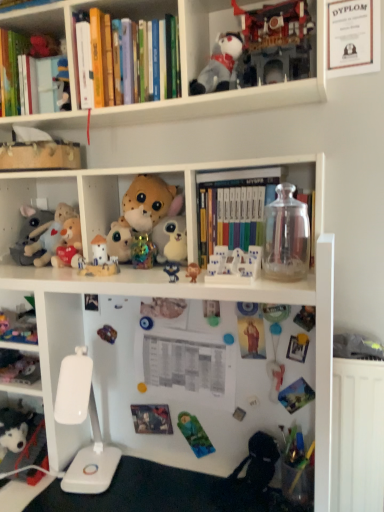
In order to face matte pink plush at lower left, acting as the 13th toy starting from the top, should I rotate leftwards or rightwards?

You should rotate left by 22.633 degrees.

How much space does transparent glass jar at center, which appears as the first book when ordered from the bottom, occupy horizontally?

The width of transparent glass jar at center, which appears as the first book when ordered from the bottom, is 6.30 inches.

The width and height of the screenshot is (384, 512). Describe the element at coordinates (29, 233) in the screenshot. I see `fluffy plush toy at left, marked as the 4th toy in a top-to-bottom arrangement` at that location.

In order to face matte green book at upper left, the third book in the right-to-left sequence, should I rotate leftwards or rightwards?

Turn left approximately 22.363 degrees to face it.

Based on the photo, what is the approximate height of matte green book at upper left, the 3th book positioned from the bottom?

10.53 inches.

Find the location of `porcelain figurines at center, which is the eighth toy in top-to-bottom order`. porcelain figurines at center, which is the eighth toy in top-to-bottom order is located at coordinates (234, 266).

From the image's perspective, which one is positioned higher, porcelain figurines at center, the eighth toy when ordered from bottom to top, or matte plastic toy at upper center, positioned as the 1th toy in top-to-bottom order?

matte plastic toy at upper center, positioned as the 1th toy in top-to-bottom order, appears higher in the image.

What's the angular difference between porcelain figurines at center, the eighth toy when ordered from bottom to top, and matte plastic toy at upper center, positioned as the 1th toy in top-to-bottom order,'s facing directions?

There is a 0.000463-degree angle between the facing directions of porcelain figurines at center, the eighth toy when ordered from bottom to top, and matte plastic toy at upper center, positioned as the 1th toy in top-to-bottom order.

Based on the photo, is porcelain figurines at center, which is the eighth toy in top-to-bottom order, beside matte plastic toy at upper center, positioned as the 1th toy in top-to-bottom order?

There is a gap between porcelain figurines at center, which is the eighth toy in top-to-bottom order, and matte plastic toy at upper center, positioned as the 1th toy in top-to-bottom order.

Considering the sizes of porcelain figurines at center, the eighth toy when ordered from bottom to top, and matte plastic toy at upper center, acting as the 15th toy starting from the bottom, in the image, is porcelain figurines at center, the eighth toy when ordered from bottom to top, wider or thinner than matte plastic toy at upper center, acting as the 15th toy starting from the bottom,?

Clearly, porcelain figurines at center, the eighth toy when ordered from bottom to top, has more width compared to matte plastic toy at upper center, acting as the 15th toy starting from the bottom.

Considering the positions of objects fluffy plush toys at left and matte green book at upper left, the first book positioned from the top, in the image provided, who is more to the right, fluffy plush toys at left or matte green book at upper left, the first book positioned from the top,?

Positioned to the right is fluffy plush toys at left.

Is point (33, 193) positioned in front of point (16, 82)?

No, (33, 193) is further to viewer.

Is fluffy plush toys at left bigger or smaller than matte green book at upper left, the first book positioned from the top?

Considering their sizes, fluffy plush toys at left takes up more space than matte green book at upper left, the first book positioned from the top.

Considering their positions, is fluffy plush toys at left located in front of or behind matte green book at upper left, the 3th book positioned from the bottom?

fluffy plush toys at left is positioned closer to the viewer than matte green book at upper left, the 3th book positioned from the bottom.

Starting from the fluffy plush toys at left, which toy is the 12th one in front? Please provide its 2D coordinates.

[(234, 266)]

What's the angular difference between porcelain figurines at center, the eighth toy when ordered from bottom to top, and fluffy plush toys at left's facing directions?

2.14 degrees separate the facing orientations of porcelain figurines at center, the eighth toy when ordered from bottom to top, and fluffy plush toys at left.

From a real-world perspective, between porcelain figurines at center, the eighth toy when ordered from bottom to top, and fluffy plush toys at left, who is vertically higher?

From a 3D spatial view, fluffy plush toys at left is above.

From the image's perspective, is porcelain figurines at center, which is the eighth toy in top-to-bottom order, positioned above or below fluffy plush toys at left?

From the image's perspective, porcelain figurines at center, which is the eighth toy in top-to-bottom order, appears below fluffy plush toys at left.

Can you confirm if transparent glass jar at center, which appears as the first book when ordered from the bottom, is positioned to the right of matte plastic toy at upper center, acting as the 15th toy starting from the bottom?

No, transparent glass jar at center, which appears as the first book when ordered from the bottom, is not to the right of matte plastic toy at upper center, acting as the 15th toy starting from the bottom.

Between transparent glass jar at center, arranged as the third book when viewed from the top, and matte plastic toy at upper center, positioned as the 1th toy in top-to-bottom order, which one has smaller width?

matte plastic toy at upper center, positioned as the 1th toy in top-to-bottom order, is thinner.

Are transparent glass jar at center, which appears as the first book when ordered from the bottom, and matte plastic toy at upper center, acting as the 15th toy starting from the bottom, beside each other?

No.

Is matte plastic toy at upper center, acting as the 15th toy starting from the bottom, at the back of transparent glass jar at center, arranged as the third book when viewed from the top?

No, transparent glass jar at center, arranged as the third book when viewed from the top,'s orientation is not away from matte plastic toy at upper center, acting as the 15th toy starting from the bottom.

Based on the photo, what's the angular difference between green matte magnet at center, which is counted as the eleventh toy, starting from the top, and transparent glass jar at center, which appears as the first book when ordered from the bottom,'s facing directions?

The angle between the facing direction of green matte magnet at center, which is counted as the eleventh toy, starting from the top, and the facing direction of transparent glass jar at center, which appears as the first book when ordered from the bottom, is 0.000952 degrees.

Identify the location of the 8th toy positioned below the transparent glass jar at center, which appears as the first book when ordered from the bottom (from a real-world perspective). point(211,312).

Between green matte magnet at center, which is counted as the eleventh toy, starting from the top, and transparent glass jar at center, which appears as the first book when viewed from the right, which one has larger size?

Bigger between the two is transparent glass jar at center, which appears as the first book when viewed from the right.

Considering the sizes of objects green matte magnet at center, which is counted as the eleventh toy, starting from the top, and transparent glass jar at center, which appears as the first book when ordered from the bottom, in the image provided, who is shorter, green matte magnet at center, which is counted as the eleventh toy, starting from the top, or transparent glass jar at center, which appears as the first book when ordered from the bottom,?

green matte magnet at center, which is counted as the eleventh toy, starting from the top.

Is green fabric sleeping bag at lower center, positioned as the 2th toy in bottom-to-top order, facing away from brown plush bear at center, placed as the 7th toy when sorted from bottom to top?

No, green fabric sleeping bag at lower center, positioned as the 2th toy in bottom-to-top order, is not facing away from brown plush bear at center, placed as the 7th toy when sorted from bottom to top.

Could brown plush bear at center, placed as the 7th toy when sorted from bottom to top, be considered to be inside green fabric sleeping bag at lower center, positioned as the 2th toy in bottom-to-top order?

No, green fabric sleeping bag at lower center, positioned as the 2th toy in bottom-to-top order, does not contain brown plush bear at center, placed as the 7th toy when sorted from bottom to top.

From the picture: From the image's perspective, does green fabric sleeping bag at lower center, which is counted as the fourteenth toy, starting from the top, appear higher than brown plush bear at center, placed as the 7th toy when sorted from bottom to top?

Incorrect, from the image's perspective, green fabric sleeping bag at lower center, which is counted as the fourteenth toy, starting from the top, is lower than brown plush bear at center, placed as the 7th toy when sorted from bottom to top.

Are green fabric sleeping bag at lower center, which is counted as the fourteenth toy, starting from the top, and brown plush bear at center, placed as the 7th toy when sorted from bottom to top, far apart?

No.

What's the angular difference between fluffy plush toy at left, placed as the 12th toy when sorted from bottom to top, and matte plastic toy at upper center, acting as the 15th toy starting from the bottom,'s facing directions?

1.27 degrees.

Is fluffy plush toy at left, marked as the 4th toy in a top-to-bottom arrangement, not close to matte plastic toy at upper center, acting as the 15th toy starting from the bottom?

That's not correct — fluffy plush toy at left, marked as the 4th toy in a top-to-bottom arrangement, is a little close to matte plastic toy at upper center, acting as the 15th toy starting from the bottom.

Can you confirm if fluffy plush toy at left, marked as the 4th toy in a top-to-bottom arrangement, is positioned to the right of matte plastic toy at upper center, positioned as the 1th toy in top-to-bottom order?

No.

Does fluffy plush toy at left, placed as the 12th toy when sorted from bottom to top, have a lesser width compared to matte plastic toy at upper center, positioned as the 1th toy in top-to-bottom order?

Incorrect, the width of fluffy plush toy at left, placed as the 12th toy when sorted from bottom to top, is not less than that of matte plastic toy at upper center, positioned as the 1th toy in top-to-bottom order.

Locate an element on the screen. toy that is the 7th one above the porcelain figurines at center, the eighth toy when ordered from bottom to top (from a real-world perspective) is located at coordinates (279, 40).

Identify the location of cabinet below the matte green book at upper left, acting as the first book starting from the left (from the image's perspective). Image resolution: width=384 pixels, height=512 pixels. (27, 202).

Based on their spatial positions, is hardcover books at upper center, arranged as the second book when ordered from the bottom, or fluffy plush toys at left closer to fluffy plush toy at left, placed as the 12th toy when sorted from bottom to top?

fluffy plush toys at left is closer to fluffy plush toy at left, placed as the 12th toy when sorted from bottom to top.

Estimate the real-world distances between objects in this image. Which object is closer to white plastic toy at center, which is the ninth toy in bottom-to-top order, blue fabric plush at center, the tenth toy positioned from the top, or white plush dog at lower left, positioned as the 15th toy in top-to-bottom order?

blue fabric plush at center, the tenth toy positioned from the top, is positioned closer to the anchor white plastic toy at center, which is the ninth toy in bottom-to-top order.

Looking at the image, which one is located closer to matte plastic toy at lower left, the fourth toy from the bottom, porcelain figurines at center, which is the eighth toy in top-to-bottom order, or white plush dog at lower left, positioned as the 15th toy in top-to-bottom order?

white plush dog at lower left, positioned as the 15th toy in top-to-bottom order, is positioned closer to the anchor matte plastic toy at lower left, the fourth toy from the bottom.

Estimate the real-world distances between objects in this image. Which object is closer to green fabric sleeping bag at lower center, which is counted as the fourteenth toy, starting from the top, matte black stuffed animal at upper center or transparent glass jar at center, arranged as the third book when viewed from the top?

The object closer to green fabric sleeping bag at lower center, which is counted as the fourteenth toy, starting from the top, is transparent glass jar at center, arranged as the third book when viewed from the top.

Which object lies nearer to the anchor point fluffy plush bear at center, which ranks as the thirteenth toy in bottom-to-top order, transparent glass jar at upper right, the fifth toy viewed from the top, or white plastic toy at center, which is the ninth toy in bottom-to-top order?

white plastic toy at center, which is the ninth toy in bottom-to-top order, lies closer to fluffy plush bear at center, which ranks as the thirteenth toy in bottom-to-top order, than the other object.

When comparing their distances from fluffy plush bear at center, the 3th toy in the top-to-bottom sequence, does green matte magnet at center, acting as the 5th toy starting from the bottom, or fluffy plush toys at left seem further?

Among the two, fluffy plush toys at left is located further to fluffy plush bear at center, the 3th toy in the top-to-bottom sequence.

From the image, which object appears to be farther from hardcover books at upper center, which appears as the 2th book when viewed from the right, transparent glass jar at center, arranged as the third book when viewed from the left, or brown plush bear at center, the ninth toy from the top?

Based on the image, brown plush bear at center, the ninth toy from the top, appears to be further to hardcover books at upper center, which appears as the 2th book when viewed from the right.

From the image, which object appears to be nearer to brown plush bear at center, placed as the 7th toy when sorted from bottom to top, white plush toy at center, arranged as the tenth toy when ordered from the bottom, or matte plastic toy at lower left, the fourth toy from the bottom?

Based on the image, white plush toy at center, arranged as the tenth toy when ordered from the bottom, appears to be nearer to brown plush bear at center, placed as the 7th toy when sorted from bottom to top.

What are the coordinates of `cabinet between matte pink plush at lower left, acting as the 13th toy starting from the top, and blue fabric plush at center, which is the sixth toy from bottom to top, from left to right` in the screenshot? It's located at (27, 202).

I want to click on book between hardcover books at upper center, acting as the second book starting from the top, and green fabric sleeping bag at lower center, positioned as the 2th toy in bottom-to-top order, in the vertical direction, so click(x=244, y=204).

This screenshot has height=512, width=384. What are the coordinates of `book between fluffy plush bear at center, which ranks as the thirteenth toy in bottom-to-top order, and green fabric sleeping bag at lower center, which is counted as the fourteenth toy, starting from the top, in the up-down direction` in the screenshot? It's located at (244, 204).

Where is `cabinet situated between white plush dog at lower left, arranged as the 1th toy when ordered from the bottom, and transparent glass jar at center, arranged as the third book when viewed from the top, from left to right`? The width and height of the screenshot is (384, 512). cabinet situated between white plush dog at lower left, arranged as the 1th toy when ordered from the bottom, and transparent glass jar at center, arranged as the third book when viewed from the top, from left to right is located at coordinates (27, 202).